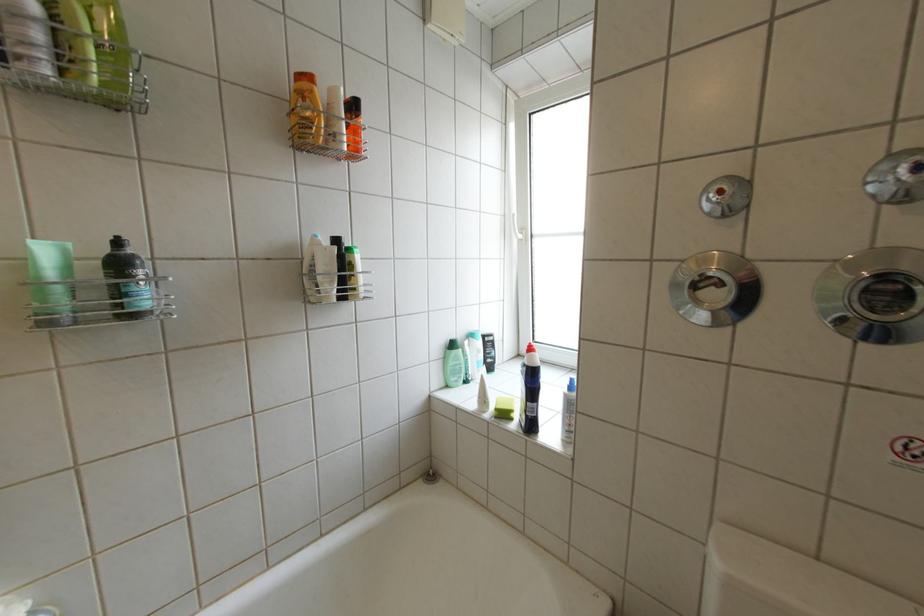
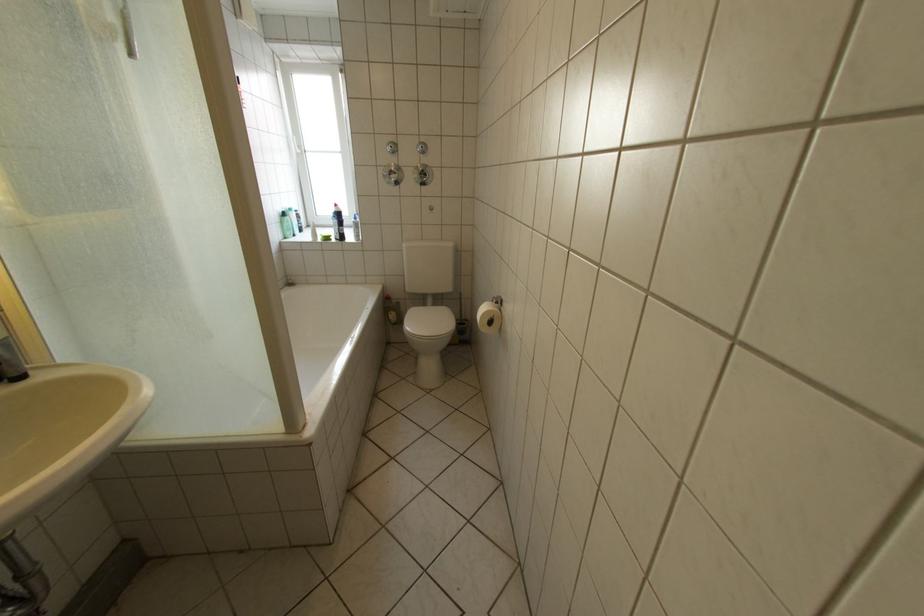
The point at (881,293) is marked in the first image. Where is the corresponding point in the second image?

(432, 175)